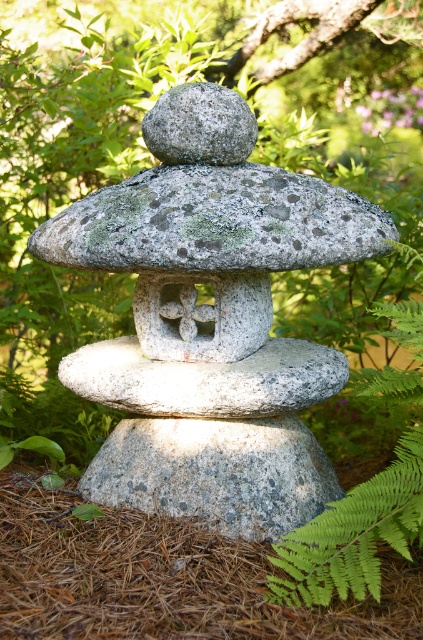
Question: Does gray/granite stone at center have a larger size compared to gray rough stone at center?

Choices:
 (A) no
 (B) yes

Answer: (B)

Question: Which object is the closest to the gray rough stone at center?

Choices:
 (A) white textured stone at center
 (B) gray/granite stone at center

Answer: (A)

Question: Where is gray/granite stone at center located in relation to white textured stone at center in the image?

Choices:
 (A) right
 (B) left

Answer: (A)

Question: Does gray/granite stone at center appear on the left side of gray rough stone at center?

Choices:
 (A) no
 (B) yes

Answer: (A)

Question: Which point is farther to the camera?

Choices:
 (A) white textured stone at center
 (B) gray rough stone at center
 (C) gray/granite stone at center

Answer: (B)

Question: Which point is farther to the camera?

Choices:
 (A) white textured stone at center
 (B) gray rough stone at center
 (C) gray/granite stone at center

Answer: (B)